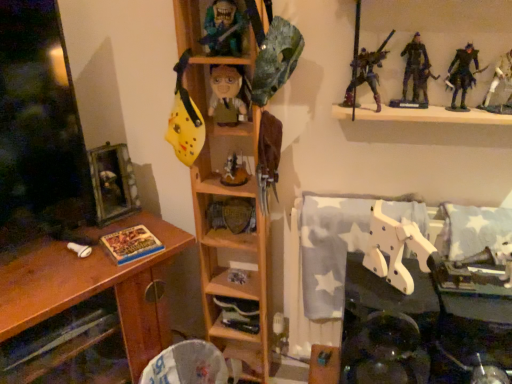
Identify the location of free location in front of wooden framed picture at left. tap(93, 240).